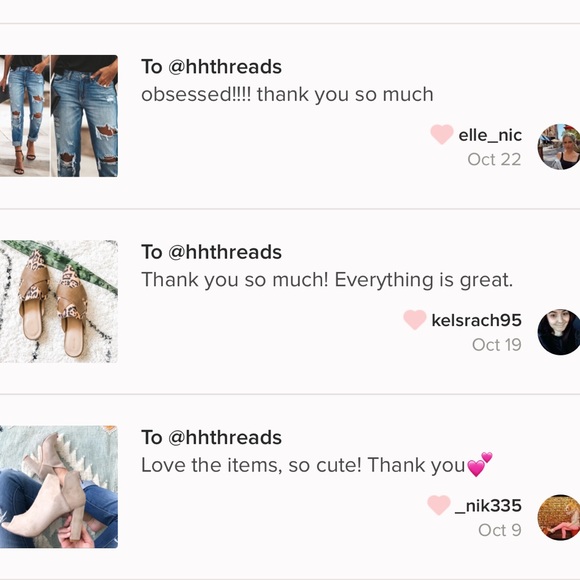
Locate an element on the screen. The height and width of the screenshot is (580, 580). blanket is located at coordinates (100, 459).